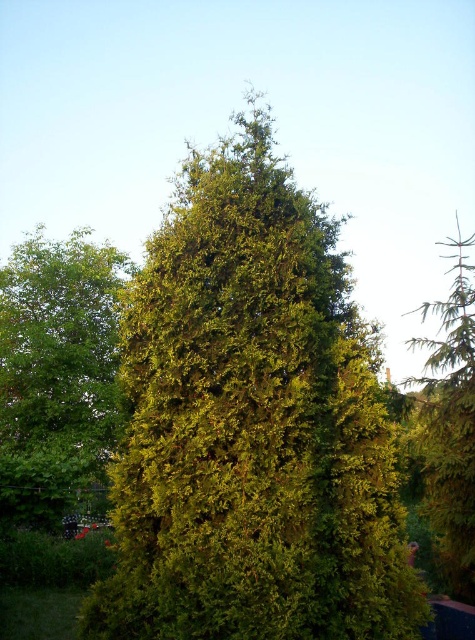
Question: Which object is closer to the camera taking this photo?

Choices:
 (A) green textured tree at center
 (B) green leafy tree at center
 (C) green textured evergreen tree at right

Answer: (A)

Question: Which of these objects is positioned closest to the green leafy tree at center?

Choices:
 (A) green textured evergreen tree at right
 (B) green textured tree at center

Answer: (B)

Question: Is green textured tree at center thinner than green leafy tree at center?

Choices:
 (A) no
 (B) yes

Answer: (A)

Question: Can you confirm if green textured tree at center is bigger than green leafy tree at center?

Choices:
 (A) yes
 (B) no

Answer: (A)

Question: Which of the following is the farthest from the observer?

Choices:
 (A) (79, 481)
 (B) (219, 280)

Answer: (A)

Question: Can you confirm if green textured tree at center is bigger than green textured evergreen tree at right?

Choices:
 (A) no
 (B) yes

Answer: (A)